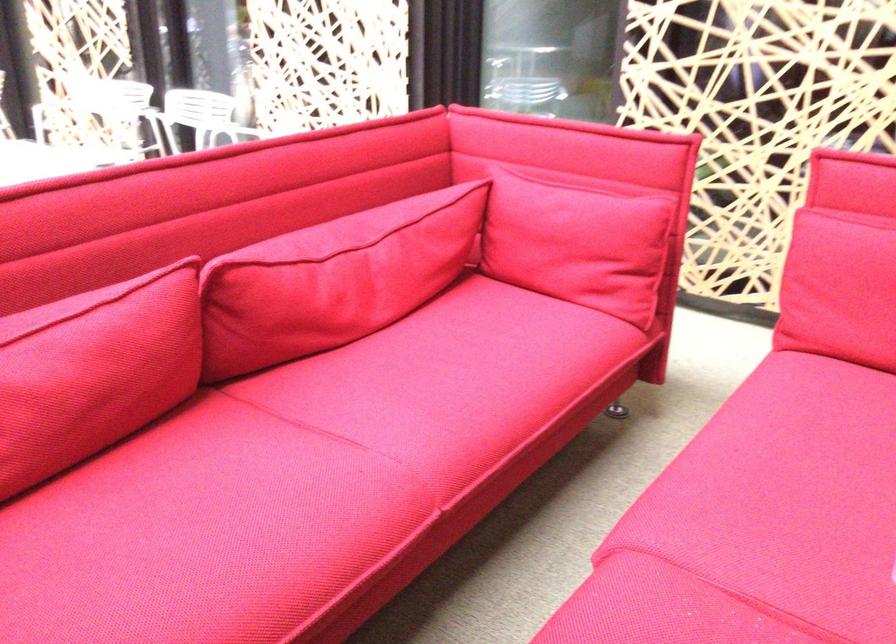
Where is `red sofa armrest`? The image size is (896, 644). red sofa armrest is located at coordinates (591, 109).